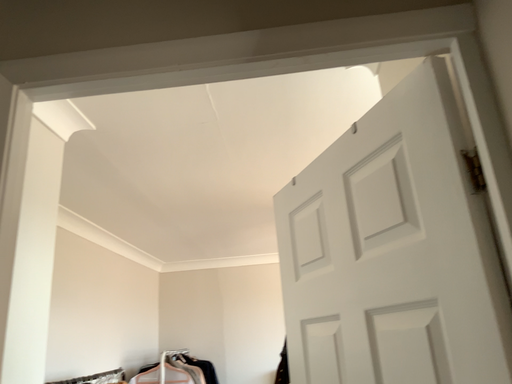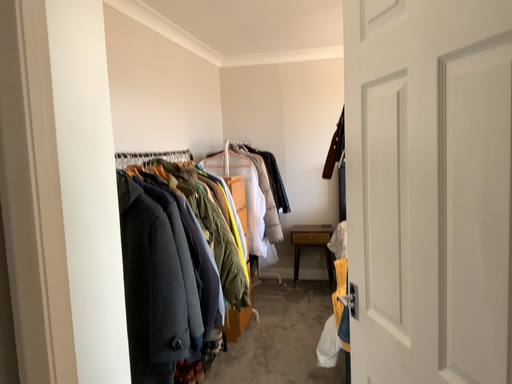
Question: Which way did the camera rotate in the video?

Choices:
 (A) rotated upward
 (B) rotated downward

Answer: (B)